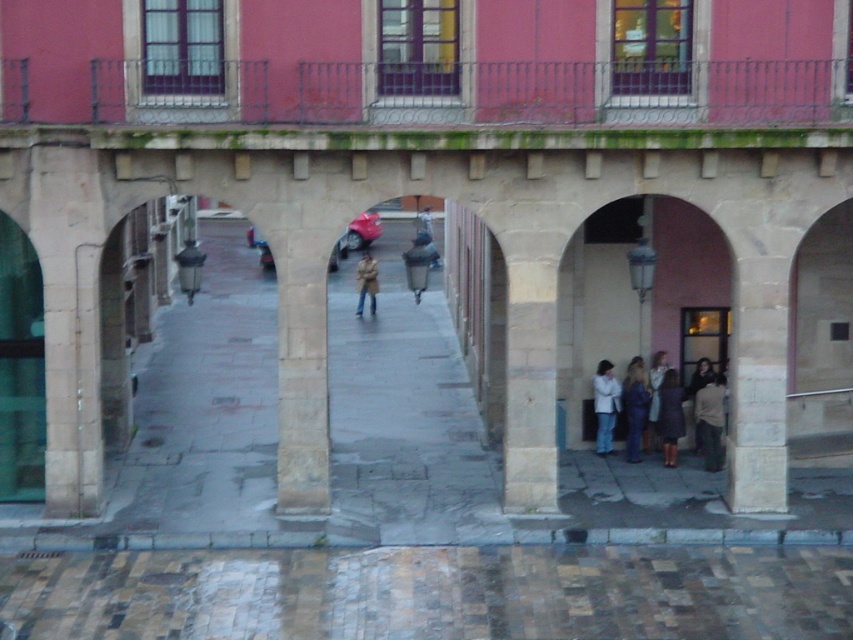
You are standing on the wet paved area in front of the arches and see both the denim jacket at lower right and the white textured coat at lower right. Which one is positioned more to the left side?

The denim jacket at lower right is positioned more to the left side than the white textured coat at lower right.

You are a delivery person carrying a package that is 10 inches wide. You see the light beige coat at center and the light brown fabric jacket at lower right. Can you fit the package between them without bending it?

The distance between the light beige coat at center and the light brown fabric jacket at lower right is 9.28 inches. Since the package is 10 inches wide, it cannot fit between them without bending.